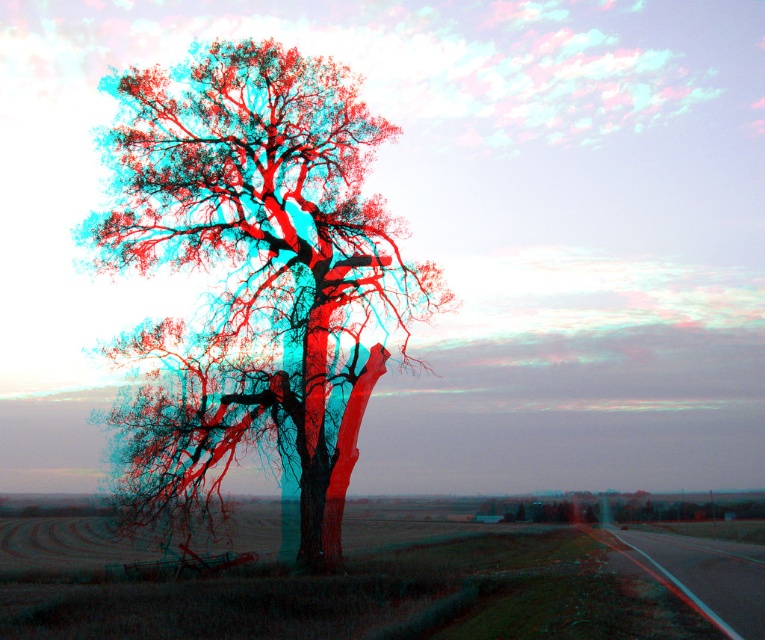
You are standing at the point with coordinates point (750, 582) and want to walk towards the tree in the scene. Will the point with coordinates point (181, 198) block your path?

The point (181, 198) is behind point (750, 582), so it will not block your path when walking towards the tree.

You are standing at the viewpoint of the image and want to know how far you are from the point marked as point (337, 140). Can you determine the distance?

The distance between you and the point (337, 140) is 28.20 meters.

In the scene shown: You are driving along the road and want to park near the smooth bark tree at center and the black asphalt highway at lower right. Which object is closer to you if you are approaching from the direction of the highway?

The smooth bark tree at center is closer to you than the black asphalt highway at lower right because it is positioned further to the viewer, meaning it is nearer in your line of sight when approaching from the highway direction.